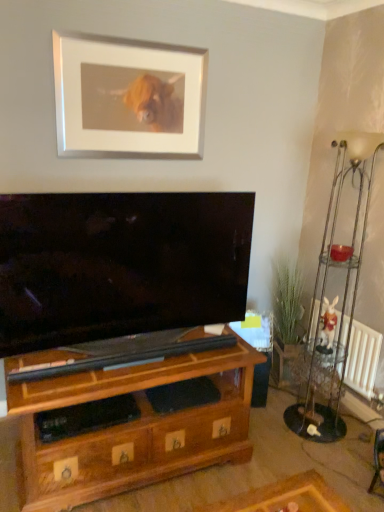
You are a GUI agent. You are given a task and a screenshot of the screen. Output one action in this format:
    pyautogui.click(x=<x>, y=<y>)
    Task: Click on the free point below white radiator at lower right (from a real-world perspective)
    The image size is (384, 512).
    Given the screenshot: What is the action you would take?
    pyautogui.click(x=353, y=417)